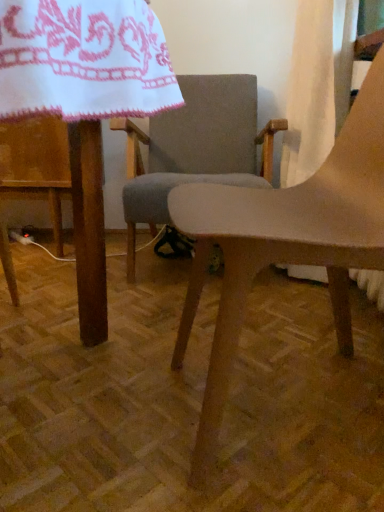
Image resolution: width=384 pixels, height=512 pixels. In order to click on free region under matte wood chair at center, the 1th chair when ordered from front to back (from a real-world perspective) in this screenshot , I will do `click(293, 406)`.